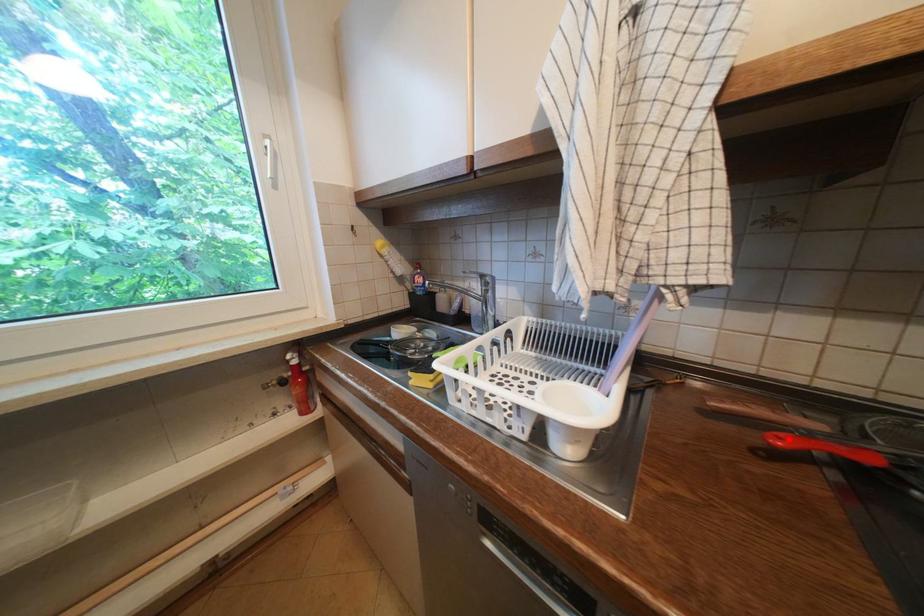
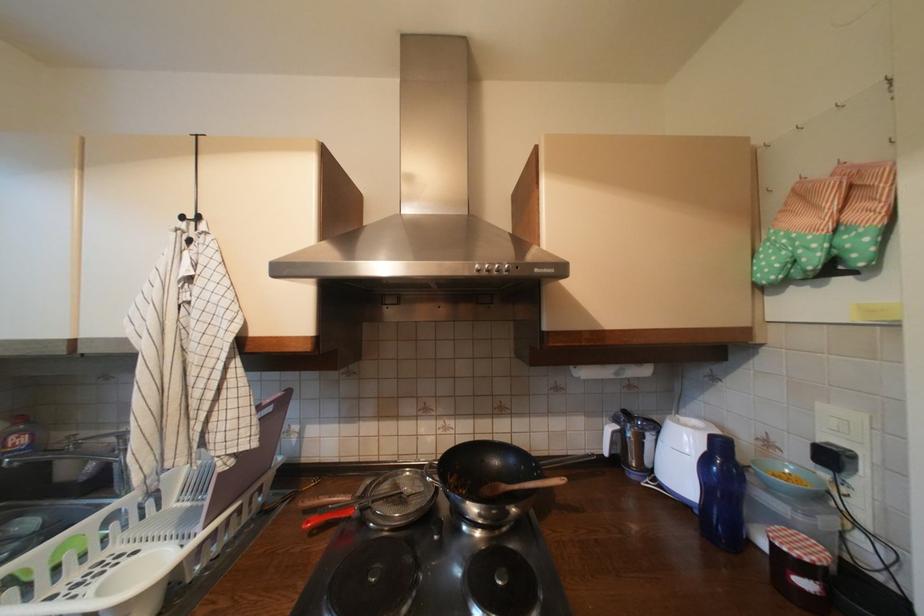
In the second image, find the point that corresponds to the highlighted location in the first image.

(317, 524)